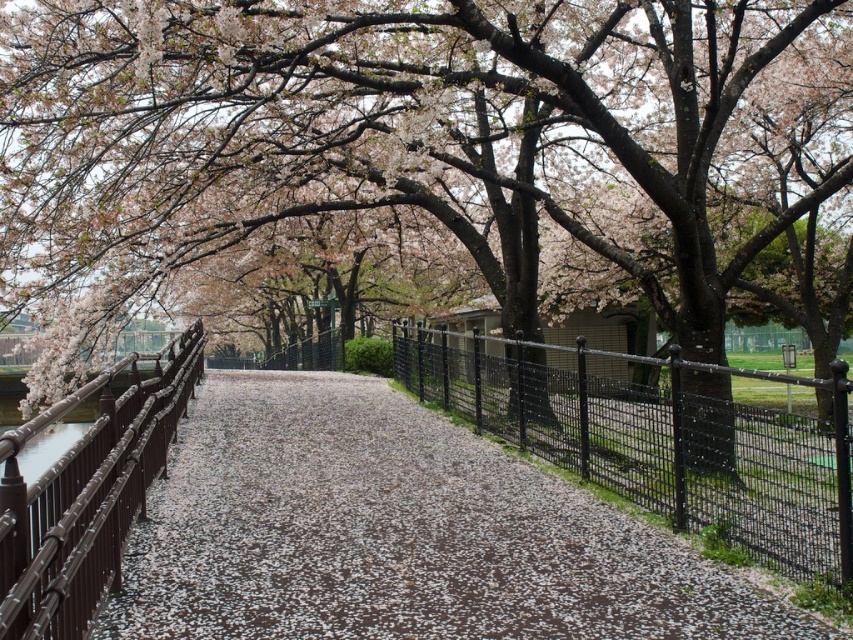
You are walking along the cherry blossom pathway and notice two fences. The black metal fence at center and the brown wrought iron fence at left. Which fence is closer to you as you walk towards the pathway?

The black metal fence at center is closer to you because it is positioned over the brown wrought iron fence at left, indicating it is in front.

You are a gardener trying to place a new bench along the white gravel path at center. The bench is 1.2 meters wide. Can you fit it on the path without crossing over the black metal fence at center?

The white gravel path at center might be wider than black metal fence at center, so there is a possibility that the bench can fit. However, since the exact width difference isn not specified, it is recommended to measure the path width before placing the bench.

You are standing at the entrance of the cherry blossom pathway and want to walk to the middle of the white gravel path at center. According to the coordinates provided, what is the exact position you should aim for?

The exact position to aim for is point 0.834 on the x axis and 0.468 on the y axis.